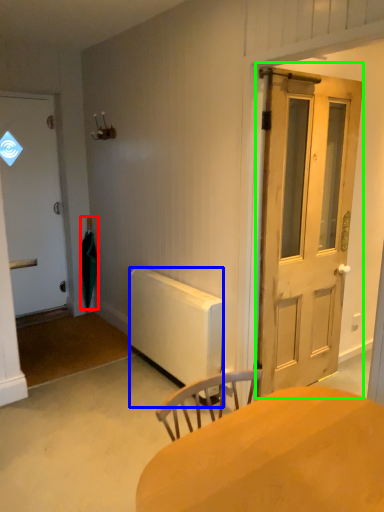
Question: Which object is positioned farthest from umbrella (highlighted by a red box)? Select from radiator (highlighted by a blue box) and door (highlighted by a green box).

Choices:
 (A) radiator
 (B) door

Answer: (B)